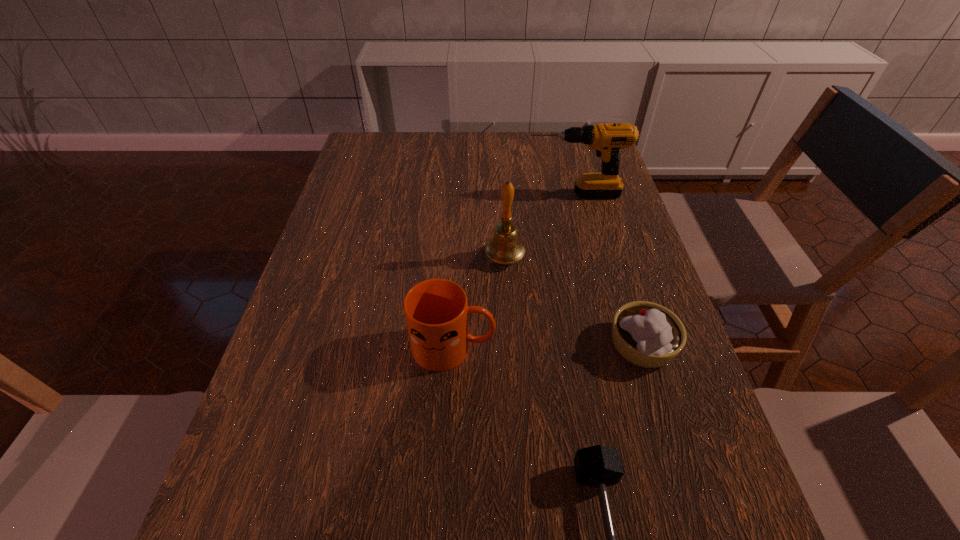
The image size is (960, 540). Identify the location of bell. [505, 248].

The image size is (960, 540). Identify the location of drill. (607, 140).

The image size is (960, 540). Find the location of `mug`. mug is located at coordinates point(436,310).

Where is `whipped cream`? The width and height of the screenshot is (960, 540). whipped cream is located at coordinates pyautogui.click(x=646, y=334).

Identify the location of vacant area situated on the right of the fourth nearest object. The width and height of the screenshot is (960, 540). (646, 258).

The image size is (960, 540). Identify the location of vacant space located at the tip of the farthest object. (435, 194).

Locate an element on the screen. This screenshot has width=960, height=540. vacant space located 0.350m at the tip of the farthest object is located at coordinates (408, 194).

Identify the location of blank space located at the tip of the farthest object. The image size is (960, 540). (425, 194).

Locate an element on the screen. The height and width of the screenshot is (540, 960). free space located on the handle side of the third shortest object is located at coordinates (585, 347).

At what (x,y) coordinates should I click in order to perform the action: click on vacant region located 0.250m on the front of the whipped cream. Please return your answer as a coordinate pair (x, y). Looking at the image, I should click on (692, 508).